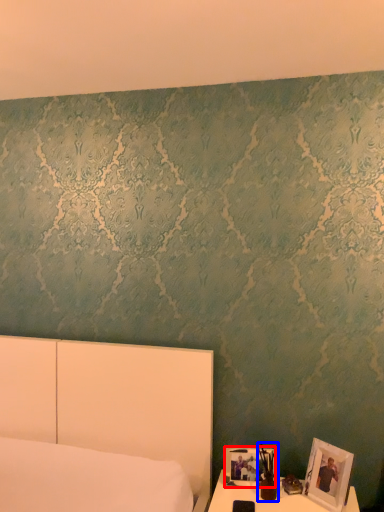
Question: Which object appears farthest to the camera in this image, picture frame (highlighted by a red box) or bedside lamp (highlighted by a blue box)?

Choices:
 (A) picture frame
 (B) bedside lamp

Answer: (A)